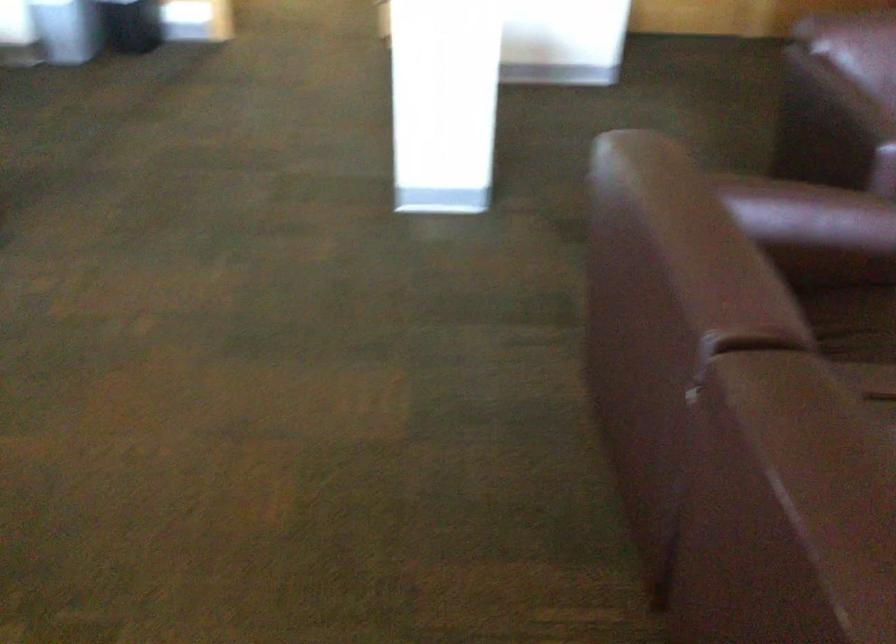
What do you see at coordinates (832, 118) in the screenshot? I see `a brown sofa armrest` at bounding box center [832, 118].